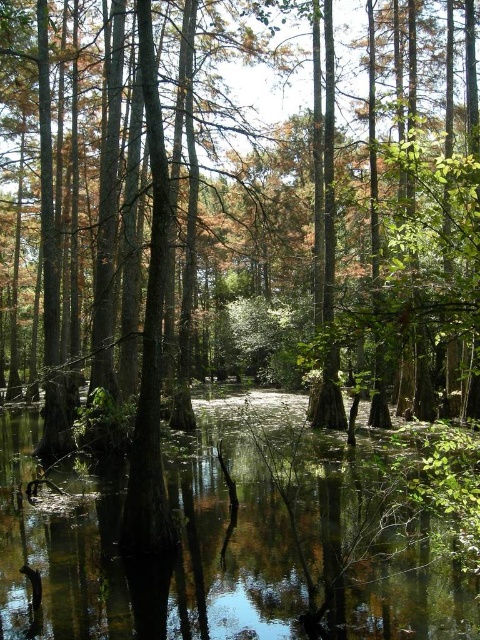
Question: Among these points, which one is nearest to the camera?

Choices:
 (A) [211, 573]
 (B) [382, 344]

Answer: (B)

Question: Is green matte tree at center wider than green reflective water at center?

Choices:
 (A) no
 (B) yes

Answer: (B)

Question: From the image, what is the correct spatial relationship of green matte tree at center in relation to green reflective water at center?

Choices:
 (A) below
 (B) above

Answer: (B)

Question: Is green matte tree at center above green reflective water at center?

Choices:
 (A) yes
 (B) no

Answer: (A)

Question: Which of the following is the farthest from the observer?

Choices:
 (A) (134, 282)
 (B) (335, 458)

Answer: (A)

Question: Which point is closer to the camera?

Choices:
 (A) green reflective water at center
 (B) green matte tree at center

Answer: (B)